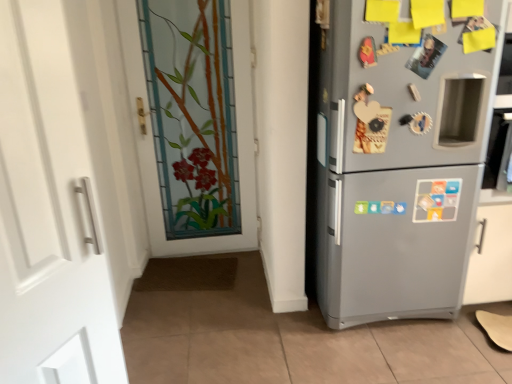
I want to click on stained glass door at center, acting as the 2th door starting from the front, so 199,125.

Is point (205, 175) closer to viewer compared to point (412, 138)?

No, (205, 175) is behind (412, 138).

Does stained glass door at center, acting as the 2th door starting from the front, have a greater width compared to satin silver fridge at right?

No.

Is stained glass door at center, the 2th door from the left, spatially inside satin silver fridge at right, or outside of it?

stained glass door at center, the 2th door from the left, is located beyond the bounds of satin silver fridge at right.

From a real-world perspective, is white matte door at left, placed as the first door when sorted from left to right, physically below stained glass door at center, which appears as the 1th door when viewed from the back?

No, from a real-world perspective, white matte door at left, placed as the first door when sorted from left to right, is not under stained glass door at center, which appears as the 1th door when viewed from the back.

Consider the image. Can you confirm if white matte door at left, the first door positioned from the front, is smaller than stained glass door at center, acting as the 2th door starting from the front?

Yes.

Is white matte door at left, the first door positioned from the front, wider or thinner than stained glass door at center, acting as the 2th door starting from the front?

In the image, white matte door at left, the first door positioned from the front, appears to be more narrow than stained glass door at center, acting as the 2th door starting from the front.

Does satin silver fridge at right turn towards white matte door at left, which ranks as the 2th door in right-to-left order?

No, satin silver fridge at right is not oriented towards white matte door at left, which ranks as the 2th door in right-to-left order.

How distant is satin silver fridge at right from white matte door at left, placed as the first door when sorted from left to right?

They are 4.23 feet apart.

Considering the sizes of satin silver fridge at right and white matte door at left, the first door positioned from the front, in the image, is satin silver fridge at right taller or shorter than white matte door at left, the first door positioned from the front,?

In the image, satin silver fridge at right appears to be taller than white matte door at left, the first door positioned from the front.

From the image's perspective, between satin silver fridge at right and white matte door at left, the first door positioned from the front, which one is located above?

satin silver fridge at right, from the image's perspective.

From the image's perspective, is white matte door at left, the 2th door from the back, above satin silver fridge at right?

No, from the image's perspective, white matte door at left, the 2th door from the back, is not on top of satin silver fridge at right.

How different are the orientations of white matte door at left, which ranks as the 2th door in right-to-left order, and satin silver fridge at right in degrees?

There is a 60.4-degree angle between the facing directions of white matte door at left, which ranks as the 2th door in right-to-left order, and satin silver fridge at right.

Is white matte door at left, which ranks as the 2th door in right-to-left order, smaller than satin silver fridge at right?

Yes.

Which object is more forward, white matte door at left, placed as the first door when sorted from left to right, or satin silver fridge at right?

white matte door at left, placed as the first door when sorted from left to right, is closer to the camera.

Consider the image. Is stained glass door at center, acting as the 2th door starting from the front, positioned with its back to white matte door at left, placed as the first door when sorted from left to right?

That's not correct — stained glass door at center, acting as the 2th door starting from the front, is not looking away from white matte door at left, placed as the first door when sorted from left to right.

Looking at this image, considering their positions, is stained glass door at center, which appears as the 1th door when viewed from the back, located in front of or behind white matte door at left, placed as the first door when sorted from left to right?

Clearly, stained glass door at center, which appears as the 1th door when viewed from the back, is behind white matte door at left, placed as the first door when sorted from left to right.

From a real-world perspective, which object rests below the other?

From a 3D spatial view, stained glass door at center, acting as the 1th door starting from the right, is below.

From the image's perspective, which object appears higher, satin silver fridge at right or stained glass door at center, acting as the 1th door starting from the right?

Result: stained glass door at center, acting as the 1th door starting from the right.

Is satin silver fridge at right to the left of stained glass door at center, acting as the 2th door starting from the front, from the viewer's perspective?

In fact, satin silver fridge at right is to the right of stained glass door at center, acting as the 2th door starting from the front.

Is satin silver fridge at right taller than stained glass door at center, acting as the 2th door starting from the front?

No.

From the satin silver fridge at right, count the 1st door to the left and point to it. Please provide its 2D coordinates.

[(199, 125)]

The height and width of the screenshot is (384, 512). Find the location of `door below the stained glass door at center, which appears as the 1th door when viewed from the back (from the image's perspective)`. door below the stained glass door at center, which appears as the 1th door when viewed from the back (from the image's perspective) is located at coordinates (50, 209).

Consider the image. Considering their positions, is satin silver fridge at right positioned further to white matte door at left, which ranks as the 2th door in right-to-left order, than stained glass door at center, acting as the 1th door starting from the right?

stained glass door at center, acting as the 1th door starting from the right, lies further to white matte door at left, which ranks as the 2th door in right-to-left order, than the other object.

Looking at the image, which one is located further to satin silver fridge at right, white matte door at left, the first door positioned from the front, or stained glass door at center, acting as the 2th door starting from the front?

Based on the image, white matte door at left, the first door positioned from the front, appears to be further to satin silver fridge at right.

Which object lies nearer to the anchor point stained glass door at center, the 2th door from the left, white matte door at left, the first door positioned from the front, or satin silver fridge at right?

Based on the image, satin silver fridge at right appears to be nearer to stained glass door at center, the 2th door from the left.

Considering their positions, is satin silver fridge at right positioned closer to stained glass door at center, acting as the 1th door starting from the right, than white matte door at left, which ranks as the 2th door in right-to-left order?

satin silver fridge at right is closer to stained glass door at center, acting as the 1th door starting from the right.

From the image, which object appears to be farther from white matte door at left, the 2th door from the back, stained glass door at center, acting as the 1th door starting from the right, or satin silver fridge at right?

stained glass door at center, acting as the 1th door starting from the right, is further to white matte door at left, the 2th door from the back.

Considering their positions, is stained glass door at center, the 2th door from the left, positioned further to satin silver fridge at right than white matte door at left, placed as the first door when sorted from left to right?

white matte door at left, placed as the first door when sorted from left to right.

Image resolution: width=512 pixels, height=384 pixels. I want to click on refrigerator located between white matte door at left, the 2th door from the back, and stained glass door at center, acting as the 1th door starting from the right, in the depth direction, so click(398, 166).